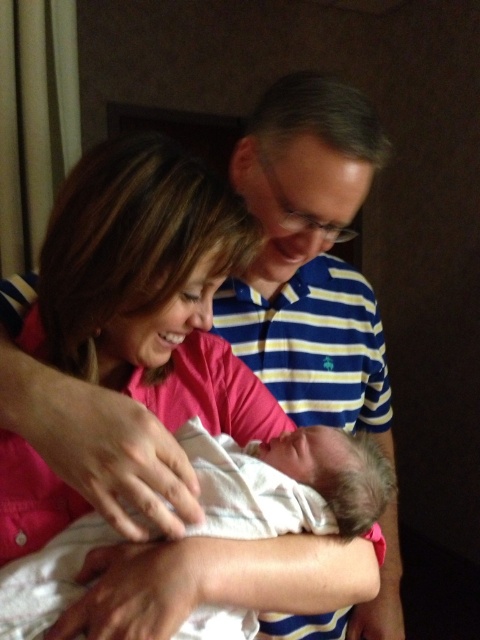
You are a photographer adjusting your camera settings to capture the scene. You notice the blue striped shirt at upper center and the white soft cloth at center. Which object should you focus on first if you want to ensure both are in sharp focus?

The blue striped shirt at upper center is further to the viewer than the white soft cloth at center, so you should focus on the blue striped shirt at upper center first to ensure both are in sharp focus.

You are a photographer trying to capture a closeup of the blue striped shirt at upper center and the white soft cloth at center. Since you can only focus on one object at a time, which one would you choose to ensure it fills the frame more naturally?

The blue striped shirt at upper center is bigger than the white soft cloth at center, so focusing on it would fill the frame more naturally.

You are an AI analyzing the image. The scene shows a woman in a bright pink shirt holding a baby, and a man in a blue and white striped shirt. Where is the blue striped shirt at upper center located in the image?

The blue striped shirt at upper center is located at the 2D coordinates point (310, 257).